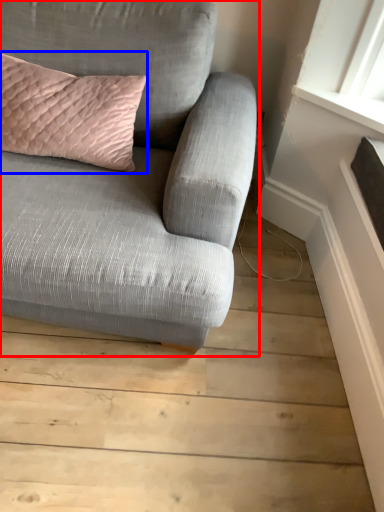
Question: Which of the following is the closest to the observer, studio couch (highlighted by a red box) or pillow (highlighted by a blue box)?

Choices:
 (A) studio couch
 (B) pillow

Answer: (A)